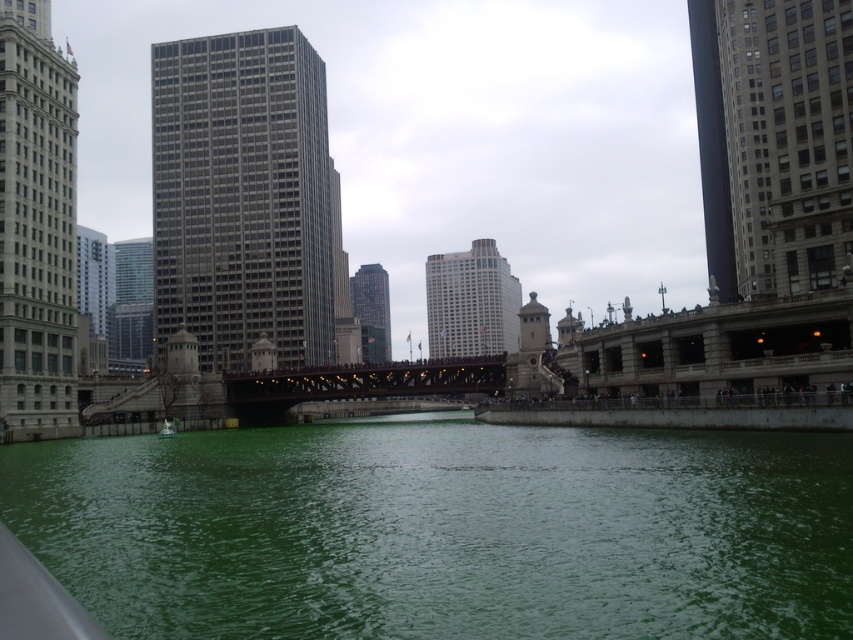
You are a drone operator tasked with capturing aerial footage of the gray glass skyscraper at center and the white stone tower at left. The drone has a maximum flight range of 200 feet from its starting position. If you position the drone exactly halfway between the two structures, will it be able to film both without exceeding its range?

The distance between the gray glass skyscraper at center and the white stone tower at left is 198.70 feet. Half of this distance is approximately 99.35 feet. Since the drone is placed halfway, it would be 99.35 feet away from each structure. The drone has a maximum range of 200 feet, so it can easily film both the gray glass skyscraper at center and the white stone tower at left without exceeding its range.

You are standing on the bridge overlooking the Chicago River and want to take a photo of the gray glass skyscraper at center and the green plastic boat at lower left. Which object should you focus on first to ensure it appears larger in your photo?

You should focus on the gray glass skyscraper at center first because it is closer to you than the green plastic boat at lower left, making it appear larger in the photo.

You are a photographer trying to capture the Chicago River scene. You want to ensure that both the gray stone skyscraper at upper right and the green plastic boat at lower left are clearly visible in your photo. Given their height difference, which object will appear larger in the final image?

The gray stone skyscraper at upper right will appear larger in the photo because it is much taller than the green plastic boat at lower left.